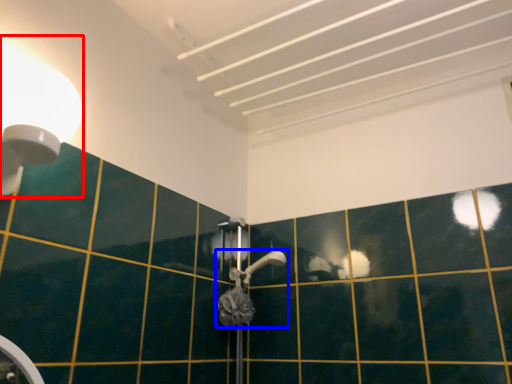
Question: Among these objects, which one is farthest to the camera, light fixture (highlighted by a red box) or shower (highlighted by a blue box)?

Choices:
 (A) light fixture
 (B) shower

Answer: (B)